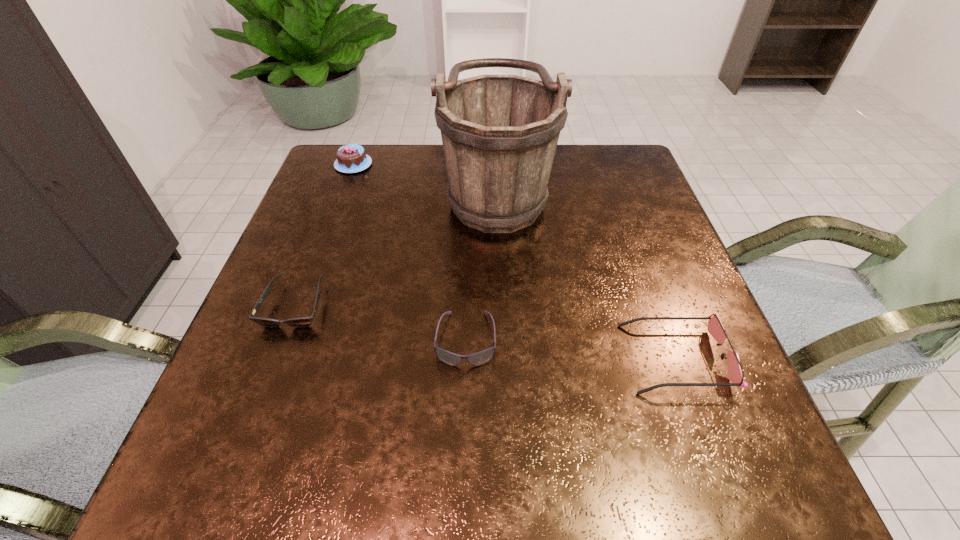
The height and width of the screenshot is (540, 960). I want to click on object positioned at the far left corner, so [352, 158].

In the image, there is a desktop. At what (x,y) coordinates should I click in order to perform the action: click on vacant space at the far edge. Please return your answer as a coordinate pair (x, y). The height and width of the screenshot is (540, 960). Looking at the image, I should click on (563, 189).

In the image, there is a desktop. Identify the location of free space at the near edge. (467, 442).

At what (x,y) coordinates should I click in order to perform the action: click on vacant space at the left edge of the desktop. Please return your answer as a coordinate pair (x, y). Image resolution: width=960 pixels, height=540 pixels. Looking at the image, I should click on (304, 240).

Locate an element on the screen. The height and width of the screenshot is (540, 960). free space at the right edge of the desktop is located at coordinates tap(653, 216).

The width and height of the screenshot is (960, 540). In the image, there is a desktop. What are the coordinates of `free region at the far left corner` in the screenshot? It's located at (310, 190).

Identify the location of unoccupied position between the chocolate cake and the leftmost sunglasses. (324, 235).

This screenshot has width=960, height=540. Identify the location of free space between the leftmost sunglasses and the rightmost object. tap(486, 332).

This screenshot has height=540, width=960. What are the coordinates of `vacant space that's between the tallest object and the leftmost sunglasses` in the screenshot? It's located at (396, 248).

This screenshot has width=960, height=540. Find the location of `vacant space in between the second sunglasses from right to left and the bucket`. vacant space in between the second sunglasses from right to left and the bucket is located at coordinates (481, 264).